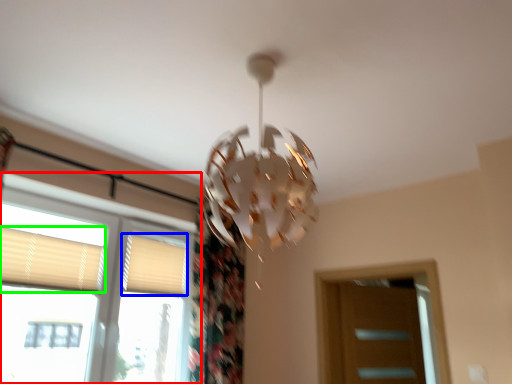
Question: Based on their relative distances, which object is nearer to window (highlighted by a red box)? Choose from shutter (highlighted by a blue box) and shutter (highlighted by a green box).

Choices:
 (A) shutter
 (B) shutter

Answer: (B)